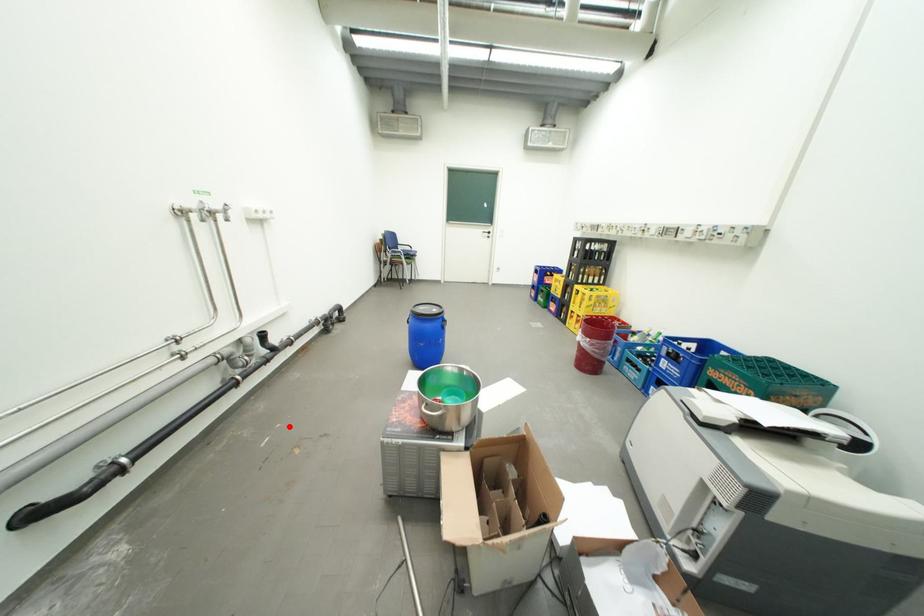
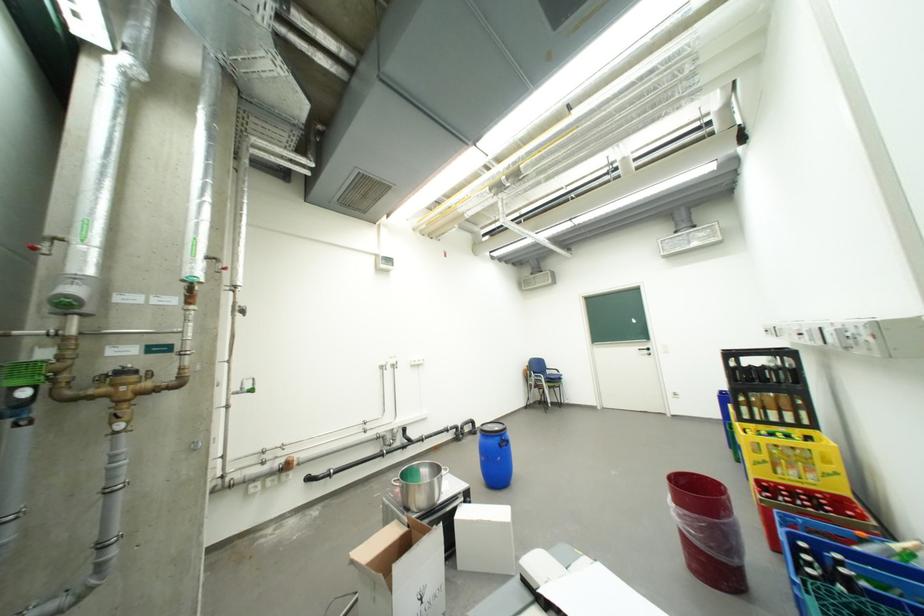
Locate, in the second image, the point that corresponds to the highlighted location in the first image.

(398, 490)